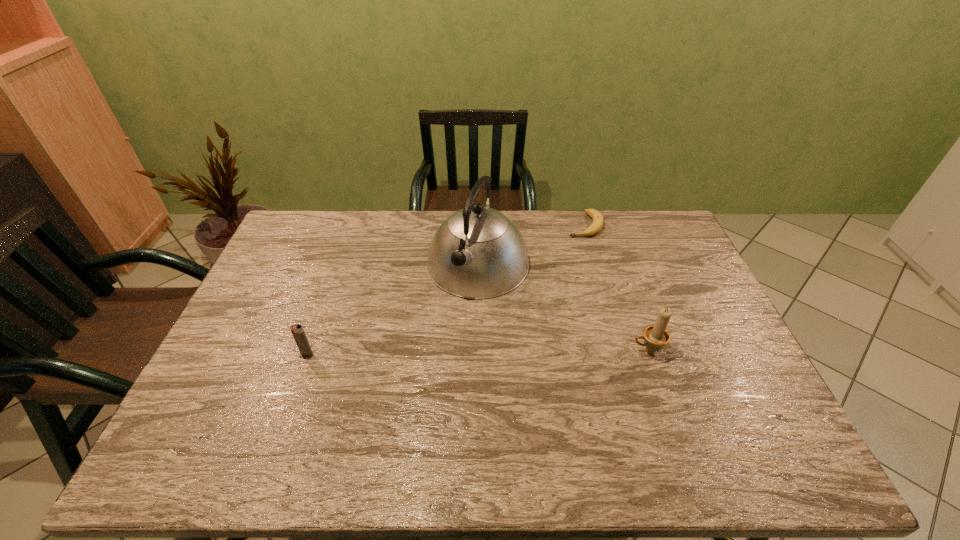
The width and height of the screenshot is (960, 540). In order to click on the second shortest object in this screenshot , I will do `click(297, 330)`.

Locate an element on the screen. Image resolution: width=960 pixels, height=540 pixels. the leftmost object is located at coordinates (297, 330).

Locate an element on the screen. The width and height of the screenshot is (960, 540). candle_holder is located at coordinates (656, 336).

At what (x,y) coordinates should I click in order to perform the action: click on the shortest object. Please return your answer as a coordinate pair (x, y). Looking at the image, I should click on (598, 221).

The height and width of the screenshot is (540, 960). I want to click on the tallest object, so click(x=477, y=253).

The image size is (960, 540). In order to click on the second object from left to right in this screenshot , I will do point(477,253).

I want to click on free space located on the right of the igniter, so click(x=454, y=354).

Where is `vacant space situated on the handle side of the candle_holder`? vacant space situated on the handle side of the candle_holder is located at coordinates (606, 350).

The width and height of the screenshot is (960, 540). In order to click on vacant area located on the handle side of the candle_holder in this screenshot , I will do `click(599, 350)`.

Where is `vacant space situated on the handle side of the candle_holder`? The width and height of the screenshot is (960, 540). vacant space situated on the handle side of the candle_holder is located at coordinates (513, 350).